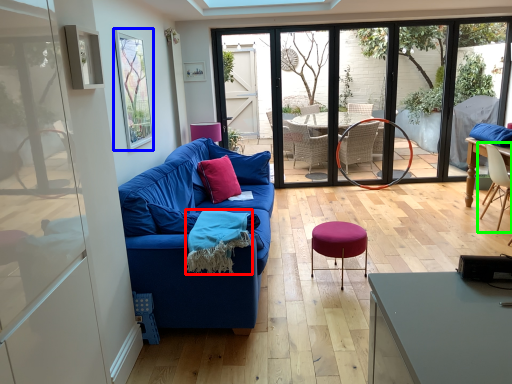
Question: Based on their relative distances, which object is farther from material (highlighted by a red box)? Choose from window screen (highlighted by a blue box) and chair (highlighted by a green box).

Choices:
 (A) window screen
 (B) chair

Answer: (B)